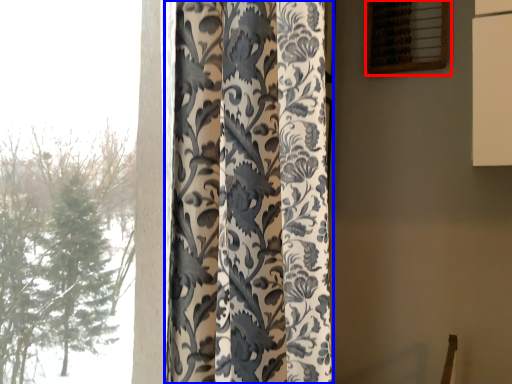
Question: Among these objects, which one is farthest to the camera, window (highlighted by a red box) or curtain (highlighted by a blue box)?

Choices:
 (A) window
 (B) curtain

Answer: (A)